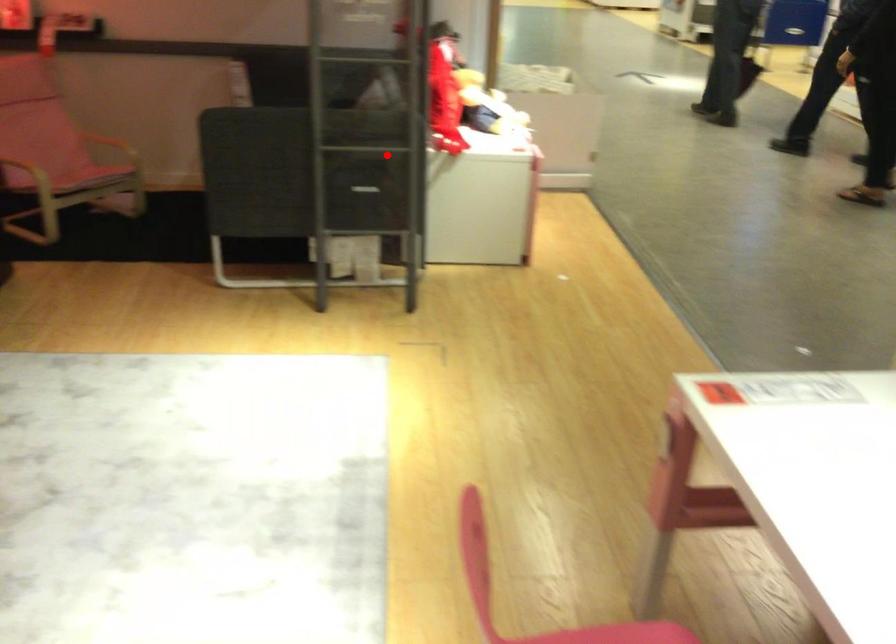
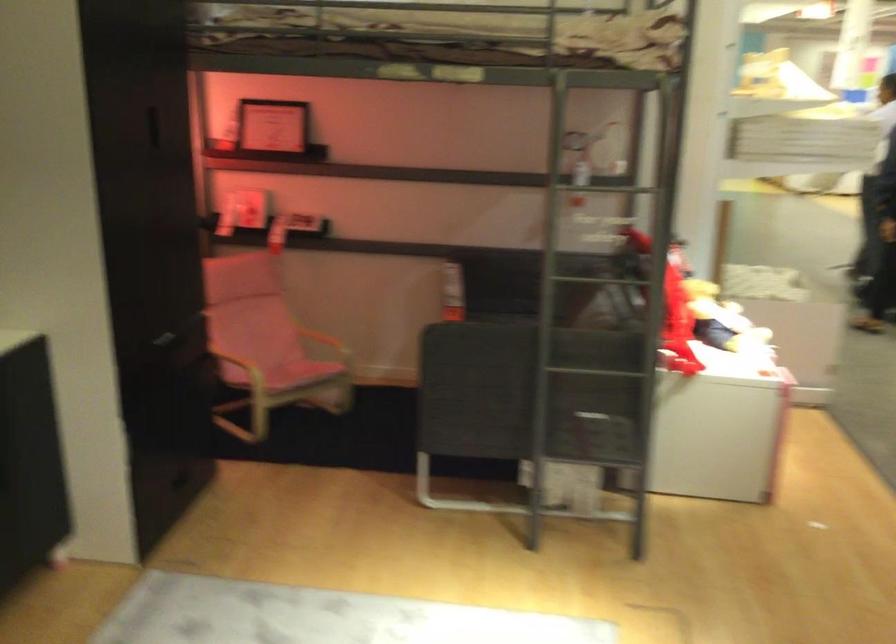
Question: I am providing you with two images of the same scene from different viewpoints. A red point is shown in image1. For the corresponding object point in image2, is it positioned nearer or farther from the camera?

Choices:
 (A) Nearer
 (B) Farther

Answer: (A)